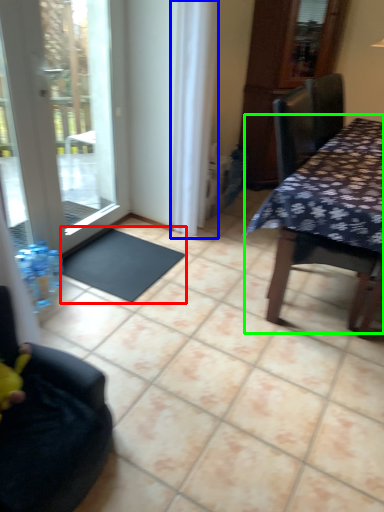
Question: Which object is positioned closest to doormat (highlighted by a red box)? Select from curtain (highlighted by a blue box) and table (highlighted by a green box).

Choices:
 (A) curtain
 (B) table

Answer: (A)